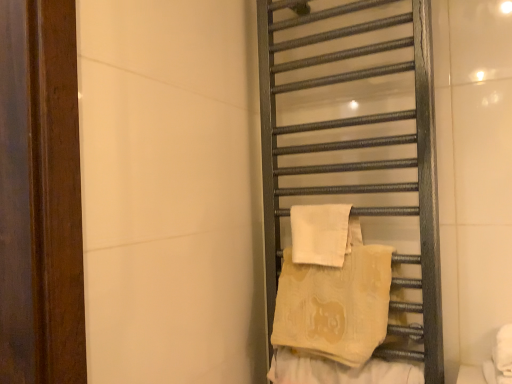
Question: Does metallic towel rack at right come in front of white cotton beach towel at right, the 2th beach towel positioned from the bottom?

Choices:
 (A) no
 (B) yes

Answer: (B)

Question: Can you confirm if metallic towel rack at right is shorter than white cotton beach towel at right, the 1th beach towel viewed from the top?

Choices:
 (A) no
 (B) yes

Answer: (A)

Question: From the image's perspective, does metallic towel rack at right appear lower than white cotton beach towel at right, the 2th beach towel positioned from the bottom?

Choices:
 (A) no
 (B) yes

Answer: (A)

Question: Is metallic towel rack at right located outside white cotton beach towel at right, the 2th beach towel positioned from the bottom?

Choices:
 (A) yes
 (B) no

Answer: (A)

Question: Is metallic towel rack at right behind white cotton beach towel at right, the 1th beach towel viewed from the top?

Choices:
 (A) yes
 (B) no

Answer: (B)

Question: Is white cotton beach towel at right, the 2th beach towel positioned from the bottom, inside metallic towel rack at right?

Choices:
 (A) no
 (B) yes

Answer: (B)

Question: Considering the relative sizes of beige textured towel at center-right and beige cotton beach towel at center-right, acting as the 2th beach towel starting from the top, in the image provided, is beige textured towel at center-right shorter than beige cotton beach towel at center-right, acting as the 2th beach towel starting from the top,?

Choices:
 (A) yes
 (B) no

Answer: (A)

Question: Is beige textured towel at center-right far away from beige cotton beach towel at center-right, acting as the 2th beach towel starting from the top?

Choices:
 (A) no
 (B) yes

Answer: (A)

Question: From the image's perspective, is beige textured towel at center-right under beige cotton beach towel at center-right, marked as the first beach towel in a bottom-to-top arrangement?

Choices:
 (A) yes
 (B) no

Answer: (A)

Question: Is beige textured towel at center-right behind beige cotton beach towel at center-right, acting as the 2th beach towel starting from the top?

Choices:
 (A) yes
 (B) no

Answer: (B)

Question: Does beige textured towel at center-right have a smaller size compared to beige cotton beach towel at center-right, acting as the 2th beach towel starting from the top?

Choices:
 (A) yes
 (B) no

Answer: (A)

Question: From a real-world perspective, is beige textured towel at center-right on beige cotton beach towel at center-right, acting as the 2th beach towel starting from the top?

Choices:
 (A) no
 (B) yes

Answer: (A)

Question: Does beige textured towel at center-right turn towards white cotton beach towel at right, the 2th beach towel positioned from the bottom?

Choices:
 (A) no
 (B) yes

Answer: (A)